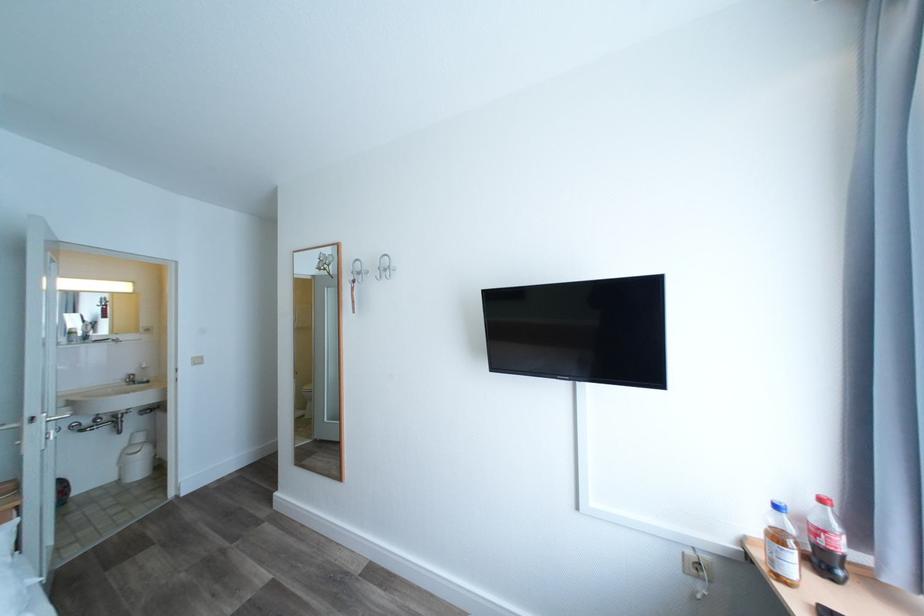
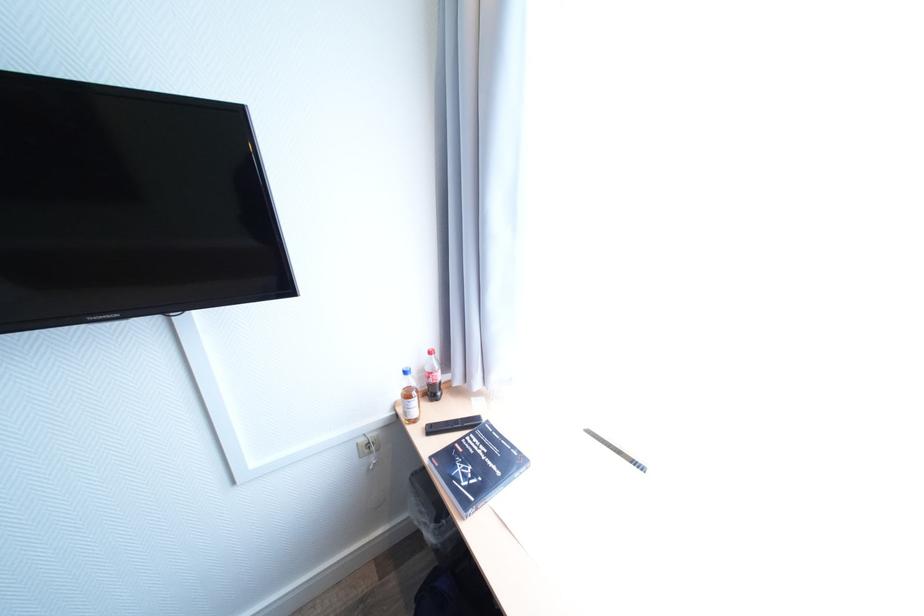
Find the pixel in the second image that matches point (828, 569) in the first image.

(439, 397)